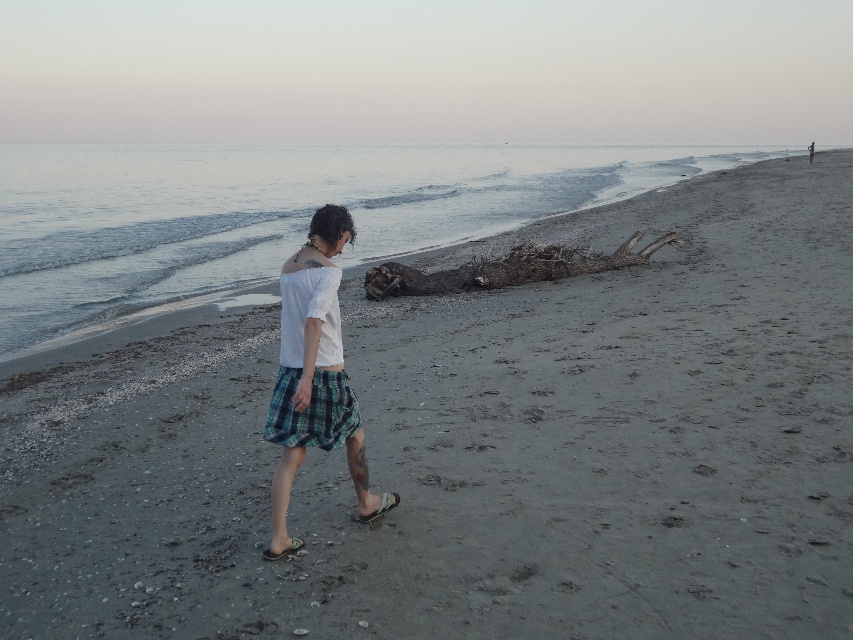
Question: Which of the following is the farthest from the observer?

Choices:
 (A) (393, 499)
 (B) (337, 433)

Answer: (A)

Question: Considering the relative positions of plaid fabric skirt at center and green fabric sandal at lower center in the image provided, where is plaid fabric skirt at center located with respect to green fabric sandal at lower center?

Choices:
 (A) below
 (B) above

Answer: (B)

Question: Which point appears farthest from the camera in this image?

Choices:
 (A) (813, 145)
 (B) (207, 180)
 (C) (289, 348)

Answer: (A)

Question: Among these objects, which one is farthest from the camera?

Choices:
 (A) white fabric shirt at center
 (B) multicolored fabric sandal at lower left
 (C) clear water at upper left
 (D) plaid fabric skirt at center

Answer: (A)

Question: Does clear water at upper left appear over plaid fabric skirt at center?

Choices:
 (A) no
 (B) yes

Answer: (B)

Question: Is white cotton shirt at center further to camera compared to green fabric sandal at lower center?

Choices:
 (A) yes
 (B) no

Answer: (B)